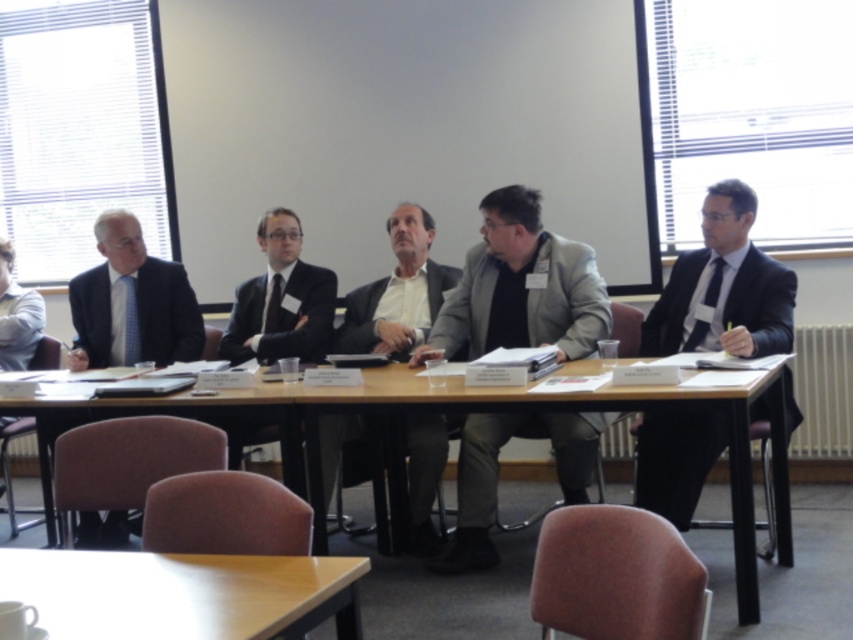
Which is more to the right, light brown wood table at lower left or light blue shirt at left?

From the viewer's perspective, light brown wood table at lower left appears more on the right side.

The width and height of the screenshot is (853, 640). What do you see at coordinates (183, 593) in the screenshot? I see `light brown wood table at lower left` at bounding box center [183, 593].

Does point (33, 566) come farther from viewer compared to point (6, 330)?

No, (33, 566) is in front of (6, 330).

Find the location of a particular element. This screenshot has height=640, width=853. light brown wood table at lower left is located at coordinates (183, 593).

From the picture: Does gray fabric jacket at center appear under wooden table at center?

Actually, gray fabric jacket at center is above wooden table at center.

Is the position of gray fabric jacket at center less distant than that of wooden table at center?

That is False.

I want to click on gray fabric jacket at center, so click(x=521, y=288).

Between matte black suit at right and light blue shirt at left, which one is positioned higher?

Positioned higher is light blue shirt at left.

Is point (698, 413) positioned before point (35, 326)?

Yes, it is.

Where is `matte black suit at right`? The height and width of the screenshot is (640, 853). matte black suit at right is located at coordinates (723, 288).